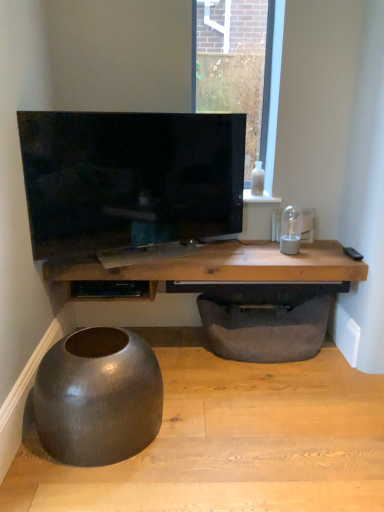
At what (x,y) coordinates should I click in order to perform the action: click on matte black shelf at center. Please return your answer as a coordinate pair (x, y). This screenshot has height=512, width=384. Looking at the image, I should click on (113, 290).

Describe the element at coordinates (259, 198) in the screenshot. I see `white glossy bottle at upper right` at that location.

Locate an element on the screen. The height and width of the screenshot is (512, 384). white glossy bottle at upper right is located at coordinates (259, 198).

You are a GUI agent. You are given a task and a screenshot of the screen. Output one action in this format:
    pyautogui.click(x=<x>, y=<y>)
    Task: Click on the matte black bowl at lower left
    The height and width of the screenshot is (512, 384).
    Given the screenshot: What is the action you would take?
    pyautogui.click(x=98, y=397)

Is point (143, 408) closer or farther from the camera than point (246, 199)?

Point (143, 408) is positioned closer to the camera compared to point (246, 199).

Is matte black bowl at lower left positioned beyond the bounds of white glossy bottle at upper right?

Yes, matte black bowl at lower left is not within white glossy bottle at upper right.

You are a GUI agent. You are given a task and a screenshot of the screen. Output one action in this format:
    pyautogui.click(x=<x>, y=<y>)
    Task: Click on the round table on the left of the white glossy bottle at upper right
    The image size is (384, 512).
    Given the screenshot: What is the action you would take?
    [x=98, y=397]

Can you see matte black bowl at lower left touching wooden table at center?

No, matte black bowl at lower left is not touching wooden table at center.

Considering the points (144, 397) and (278, 268), which point is behind, point (144, 397) or point (278, 268)?

The point (278, 268) is farther.

From the image's perspective, between matte black bowl at lower left and wooden table at center, which one is located above?

wooden table at center, from the image's perspective.

Is matte black bowl at lower left positioned with its back to wooden table at center?

No, wooden table at center is not at the back of matte black bowl at lower left.

Based on their positions, is matte black bowl at lower left located to the left or right of dark gray fabric footrest at lower center?

Clearly, matte black bowl at lower left is on the left of dark gray fabric footrest at lower center in the image.

Based on the photo, from a real-world perspective, is matte black bowl at lower left on dark gray fabric footrest at lower center?

Yes, from a real-world perspective, matte black bowl at lower left is on top of dark gray fabric footrest at lower center.

Which of these two, matte black bowl at lower left or dark gray fabric footrest at lower center, stands taller?

matte black bowl at lower left.

Does matte black bowl at lower left have a lesser width compared to dark gray fabric footrest at lower center?

Incorrect, the width of matte black bowl at lower left is not less than that of dark gray fabric footrest at lower center.

Locate an element on the screen. table above the matte black bowl at lower left (from the image's perspective) is located at coordinates (227, 266).

Is wooden table at center wider than matte black bowl at lower left?

Incorrect, the width of wooden table at center does not surpass that of matte black bowl at lower left.

Is wooden table at center not close to matte black bowl at lower left?

Actually, wooden table at center and matte black bowl at lower left are a little close together.

Considering the sizes of objects wooden table at center and matte black bowl at lower left in the image provided, who is shorter, wooden table at center or matte black bowl at lower left?

With less height is wooden table at center.

Considering the sizes of objects matte gray concrete at lower left and matte black bowl at lower left in the image provided, who is thinner, matte gray concrete at lower left or matte black bowl at lower left?

Thinner between the two is matte black bowl at lower left.

Which is correct: matte gray concrete at lower left is inside matte black bowl at lower left, or outside of it?

matte gray concrete at lower left is located beyond the bounds of matte black bowl at lower left.

From the image's perspective, between matte gray concrete at lower left and matte black bowl at lower left, which one is located above?

From the image's view, matte black bowl at lower left is above.

Are matte gray concrete at lower left and matte black bowl at lower left beside each other?

matte gray concrete at lower left and matte black bowl at lower left are clearly separated.

Is wooden table at center surrounded by matte black shelf at center?

No, wooden table at center is not a part of matte black shelf at center.

Can you tell me how much matte black shelf at center and wooden table at center differ in facing direction?

matte black shelf at center and wooden table at center are facing 1.89 degrees away from each other.

Is point (100, 285) positioned behind point (151, 272)?

Yes, it is.

How many degrees apart are the facing directions of matte gray concrete at lower left and dark gray fabric footrest at lower center?

The angle between the facing direction of matte gray concrete at lower left and the facing direction of dark gray fabric footrest at lower center is 0.744 degrees.

Between matte gray concrete at lower left and dark gray fabric footrest at lower center, which one has larger width?

matte gray concrete at lower left.

From the image's perspective, is matte gray concrete at lower left on top of dark gray fabric footrest at lower center?

No, from the image's perspective, matte gray concrete at lower left is not on top of dark gray fabric footrest at lower center.

Who is smaller, matte gray concrete at lower left or dark gray fabric footrest at lower center?

dark gray fabric footrest at lower center.

At what (x,y) coordinates should I click in order to perform the action: click on window sill located on the right of matte black bowl at lower left. Please return your answer as a coordinate pair (x, y). Looking at the image, I should click on (259, 198).

Find the location of `table behind the matte black bowl at lower left`. table behind the matte black bowl at lower left is located at coordinates (227, 266).

Considering their positions, is matte black shelf at center positioned further to wooden table at center than dark gray fabric footrest at lower center?

dark gray fabric footrest at lower center lies further to wooden table at center than the other object.

When comparing their distances from white glossy bottle at upper right, does matte black shelf at center or matte gray concrete at lower left seem further?

matte gray concrete at lower left is further to white glossy bottle at upper right.

When comparing their distances from wooden table at center, does matte black bowl at lower left or matte black shelf at center seem closer?

Based on the image, matte black shelf at center appears to be nearer to wooden table at center.

Estimate the real-world distances between objects in this image. Which object is closer to matte black bowl at lower left, matte black tv at center or dark gray fabric footrest at lower center?

Among the two, matte black tv at center is located nearer to matte black bowl at lower left.

From the image, which object appears to be farther from matte gray concrete at lower left, matte black shelf at center or wooden table at center?

matte black shelf at center is further to matte gray concrete at lower left.

From the image, which object appears to be nearer to matte black shelf at center, wooden table at center or matte black tv at center?

The object closer to matte black shelf at center is wooden table at center.

Estimate the real-world distances between objects in this image. Which object is closer to matte gray concrete at lower left, dark gray fabric footrest at lower center or white glossy bottle at upper right?

dark gray fabric footrest at lower center lies closer to matte gray concrete at lower left than the other object.

From the picture: Looking at the image, which one is located closer to white glossy bottle at upper right, dark gray fabric footrest at lower center or matte black tv at center?

Based on the image, matte black tv at center appears to be nearer to white glossy bottle at upper right.

Where is `round table located between matte black shelf at center and dark gray fabric footrest at lower center in the left-right direction`? round table located between matte black shelf at center and dark gray fabric footrest at lower center in the left-right direction is located at coordinates (98, 397).

Where is `table located between matte gray concrete at lower left and matte black shelf at center in the depth direction`? This screenshot has width=384, height=512. table located between matte gray concrete at lower left and matte black shelf at center in the depth direction is located at coordinates (227, 266).

Find the location of a particular element. The width and height of the screenshot is (384, 512). footrest between matte black tv at center and matte black bowl at lower left in the up-down direction is located at coordinates (265, 329).

Image resolution: width=384 pixels, height=512 pixels. Find the location of `round table located between matte gray concrete at lower left and wooden table at center in the depth direction`. round table located between matte gray concrete at lower left and wooden table at center in the depth direction is located at coordinates (98, 397).